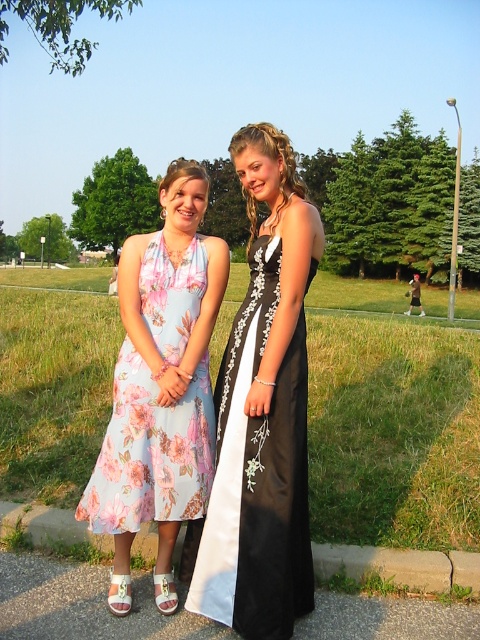
You are a photographer setting up a tripod to capture both the floral silk dress at left and the concrete at lower center in the same frame. Based on their heights, which object should you adjust the tripod height to focus on first to ensure both are visible?

The floral silk dress at left is much taller than the concrete at lower center, so you should first adjust the tripod height to focus on the floral silk dress at left to ensure both are visible in the frame.

You are a photographer standing at the point marked by the coordinate point at point (176, 516). You want to take a photo of both individuals so that they are in the same frame. Given that your camera has a maximum zoom range of 10 feet, will you be able to capture both individuals in the same frame without moving?

The two individuals are 9.49 feet apart, which is within the camera maximum zoom range of 10 feet. Therefore, you can capture both individuals in the same frame without moving.